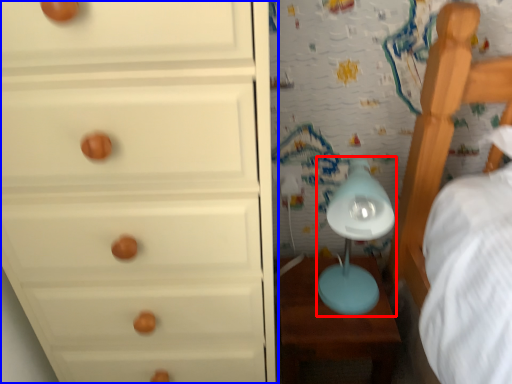
Question: Which point is closer to the camera, table lamp (highlighted by a red box) or chest of drawers (highlighted by a blue box)?

Choices:
 (A) table lamp
 (B) chest of drawers

Answer: (B)